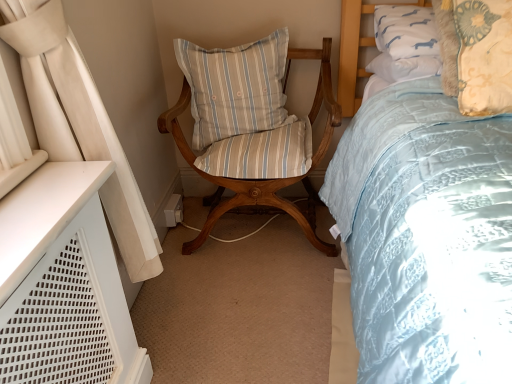
The width and height of the screenshot is (512, 384). I want to click on floral-patterned fabric pillow at upper right, which appears as the 2th pillow when viewed from the back, so click(x=476, y=53).

Measure the distance between wooden chair with striped cushion at center and camera.

The distance of wooden chair with striped cushion at center from camera is 1.52 meters.

The height and width of the screenshot is (384, 512). I want to click on light blue striped cushion at center, the first pillow positioned from the left, so click(234, 87).

Measure the distance between point (275, 43) and camera.

Point (275, 43) is 5.52 feet away from camera.

Find the location of `floral-patterned fabric pillow at upper right, the second pillow viewed from the left`. floral-patterned fabric pillow at upper right, the second pillow viewed from the left is located at coordinates (476, 53).

Who is taller, wooden chair with striped cushion at center or light blue striped cushion at center, acting as the second pillow starting from the front?

wooden chair with striped cushion at center is taller.

From a real-world perspective, count 1st pillows upward from the wooden chair with striped cushion at center and point to it. Please provide its 2D coordinates.

[(234, 87)]

Is wooden chair with striped cushion at center wider than light blue striped cushion at center, arranged as the second pillow when viewed from the right?

Indeed, wooden chair with striped cushion at center has a greater width compared to light blue striped cushion at center, arranged as the second pillow when viewed from the right.

Is there a large distance between wooden chair with striped cushion at center and light blue striped cushion at center, which is counted as the 1th pillow, starting from the back?

No, wooden chair with striped cushion at center is not far from light blue striped cushion at center, which is counted as the 1th pillow, starting from the back.

Based on the photo, in terms of height, does light blue striped cushion at center, which is counted as the 1th pillow, starting from the back, look taller or shorter compared to wooden chair with striped cushion at center?

Considering their sizes, light blue striped cushion at center, which is counted as the 1th pillow, starting from the back, has less height than wooden chair with striped cushion at center.

There is a wooden chair with striped cushion at center. Where is `the 1st pillow above it (from a real-world perspective)`? This screenshot has height=384, width=512. the 1st pillow above it (from a real-world perspective) is located at coordinates (234, 87).

Is light blue striped cushion at center, the first pillow positioned from the left, located outside wooden chair with striped cushion at center?

No, light blue striped cushion at center, the first pillow positioned from the left, is inside or overlapping with wooden chair with striped cushion at center.

How many degrees apart are the facing directions of light blue striped cushion at center, the first pillow positioned from the left, and wooden chair with striped cushion at center?

2.85 degrees.

Can you tell me how much floral-patterned fabric pillow at upper right, arranged as the 1th pillow when viewed from the right, and light blue striped cushion at center, the first pillow positioned from the left, differ in facing direction?

The angle between the facing direction of floral-patterned fabric pillow at upper right, arranged as the 1th pillow when viewed from the right, and the facing direction of light blue striped cushion at center, the first pillow positioned from the left, is 2.4 degrees.

Based on their sizes in the image, would you say floral-patterned fabric pillow at upper right, which appears as the 2th pillow when viewed from the back, is bigger or smaller than light blue striped cushion at center, which is counted as the 1th pillow, starting from the back?

In the image, floral-patterned fabric pillow at upper right, which appears as the 2th pillow when viewed from the back, appears to be smaller than light blue striped cushion at center, which is counted as the 1th pillow, starting from the back.

Consider the image. Is light blue striped cushion at center, which is counted as the 1th pillow, starting from the back, inside floral-patterned fabric pillow at upper right, the second pillow viewed from the left?

Actually, light blue striped cushion at center, which is counted as the 1th pillow, starting from the back, is outside floral-patterned fabric pillow at upper right, the second pillow viewed from the left.

Is floral-patterned fabric pillow at upper right, which appears as the 2th pillow when viewed from the back, to the left or to the right of light blue striped cushion at center, the first pillow positioned from the left, in the image?

floral-patterned fabric pillow at upper right, which appears as the 2th pillow when viewed from the back, is positioned on light blue striped cushion at center, the first pillow positioned from the left,'s right side.

Is wooden chair with striped cushion at center further to the viewer compared to floral-patterned fabric pillow at upper right, the second pillow viewed from the left?

Yes, wooden chair with striped cushion at center is further from the camera.

Can you tell me how much wooden chair with striped cushion at center and floral-patterned fabric pillow at upper right, the second pillow viewed from the left, differ in facing direction?

The angular difference between wooden chair with striped cushion at center and floral-patterned fabric pillow at upper right, the second pillow viewed from the left, is 0.451 degrees.

Is wooden chair with striped cushion at center facing away from floral-patterned fabric pillow at upper right, which appears as the 2th pillow when viewed from the back?

That's not correct — wooden chair with striped cushion at center is not looking away from floral-patterned fabric pillow at upper right, which appears as the 2th pillow when viewed from the back.

Locate an element on the screen. the 1st pillow above the wooden chair with striped cushion at center (from the image's perspective) is located at coordinates (476, 53).

Is light blue striped cushion at center, arranged as the second pillow when viewed from the right, inside the boundaries of floral-patterned fabric pillow at upper right, arranged as the 1th pillow when viewed from the right, or outside?

light blue striped cushion at center, arranged as the second pillow when viewed from the right, is outside floral-patterned fabric pillow at upper right, arranged as the 1th pillow when viewed from the right.

Which point is more distant from viewer, (x=257, y=130) or (x=449, y=0)?

The point (x=257, y=130) is more distant.

From a real-world perspective, which object stands above the other?

floral-patterned fabric pillow at upper right, the second pillow viewed from the left, is physically above.

How much distance is there between light blue striped cushion at center, the first pillow positioned from the left, and floral-patterned fabric pillow at upper right, the second pillow viewed from the left?

light blue striped cushion at center, the first pillow positioned from the left, and floral-patterned fabric pillow at upper right, the second pillow viewed from the left, are 29.46 inches apart.

Is floral-patterned fabric pillow at upper right, placed as the first pillow when sorted from front to back, far from wooden chair with striped cushion at center?

That's not correct — floral-patterned fabric pillow at upper right, placed as the first pillow when sorted from front to back, is a little close to wooden chair with striped cushion at center.

Does floral-patterned fabric pillow at upper right, placed as the first pillow when sorted from front to back, turn towards wooden chair with striped cushion at center?

No, floral-patterned fabric pillow at upper right, placed as the first pillow when sorted from front to back, is not facing towards wooden chair with striped cushion at center.

Where is `chair below the light blue striped cushion at center, acting as the second pillow starting from the front (from the image's perspective)`? chair below the light blue striped cushion at center, acting as the second pillow starting from the front (from the image's perspective) is located at coordinates (251, 127).

At what (x,y) coordinates should I click in order to perform the action: click on chair beneath the light blue striped cushion at center, acting as the second pillow starting from the front (from a real-world perspective). Please return your answer as a coordinate pair (x, y). Looking at the image, I should click on (251, 127).

Considering their positions, is floral-patterned fabric pillow at upper right, placed as the first pillow when sorted from front to back, positioned further to wooden chair with striped cushion at center than light blue striped cushion at center, arranged as the second pillow when viewed from the right?

floral-patterned fabric pillow at upper right, placed as the first pillow when sorted from front to back, lies further to wooden chair with striped cushion at center than the other object.

Based on their spatial positions, is floral-patterned fabric pillow at upper right, arranged as the 1th pillow when viewed from the right, or wooden chair with striped cushion at center closer to light blue striped cushion at center, the first pillow positioned from the left?

wooden chair with striped cushion at center.

Estimate the real-world distances between objects in this image. Which object is closer to light blue striped cushion at center, the first pillow positioned from the left, wooden chair with striped cushion at center or floral-patterned fabric pillow at upper right, which appears as the 2th pillow when viewed from the back?

wooden chair with striped cushion at center is closer to light blue striped cushion at center, the first pillow positioned from the left.

Looking at the image, which one is located further to floral-patterned fabric pillow at upper right, arranged as the 1th pillow when viewed from the right, light blue striped cushion at center, arranged as the second pillow when viewed from the right, or wooden chair with striped cushion at center?

Based on the image, light blue striped cushion at center, arranged as the second pillow when viewed from the right, appears to be further to floral-patterned fabric pillow at upper right, arranged as the 1th pillow when viewed from the right.

Estimate the real-world distances between objects in this image. Which object is closer to floral-patterned fabric pillow at upper right, placed as the first pillow when sorted from front to back, wooden chair with striped cushion at center or light blue striped cushion at center, acting as the second pillow starting from the front?

wooden chair with striped cushion at center lies closer to floral-patterned fabric pillow at upper right, placed as the first pillow when sorted from front to back, than the other object.

Estimate the real-world distances between objects in this image. Which object is closer to wooden chair with striped cushion at center, light blue striped cushion at center, arranged as the second pillow when viewed from the right, or floral-patterned fabric pillow at upper right, the second pillow viewed from the left?

light blue striped cushion at center, arranged as the second pillow when viewed from the right, lies closer to wooden chair with striped cushion at center than the other object.

This screenshot has width=512, height=384. Find the location of `chair between light blue striped cushion at center, the first pillow positioned from the left, and floral-patterned fabric pillow at upper right, which appears as the 2th pillow when viewed from the back, from left to right`. chair between light blue striped cushion at center, the first pillow positioned from the left, and floral-patterned fabric pillow at upper right, which appears as the 2th pillow when viewed from the back, from left to right is located at coordinates (251, 127).